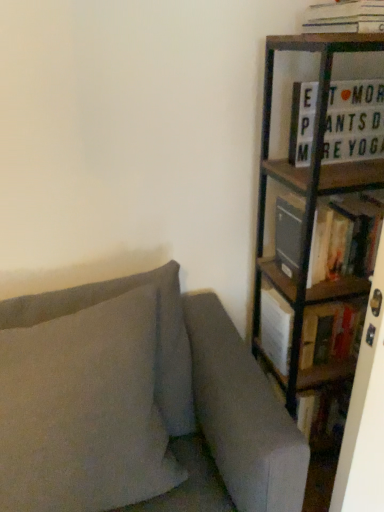
Question: Relative to white paper stack at upper right, which ranks as the third book in bottom-to-top order, is wooden bookcase at right in front or behind?

Choices:
 (A) front
 (B) behind

Answer: (A)

Question: Which is correct: wooden bookcase at right is inside white paper stack at upper right, which ranks as the third book in bottom-to-top order, or outside of it?

Choices:
 (A) outside
 (B) inside

Answer: (A)

Question: Which object is positioned farthest from the white paper stack at upper right, which ranks as the third book in bottom-to-top order?

Choices:
 (A) wooden bookshelf at right
 (B) white plastic sign at upper right, which is counted as the second book, starting from the top
 (C) hardcover book at right, which is the 1th book from bottom to top
 (D) suede-like gray pillow at left
 (E) wooden bookcase at right

Answer: (D)

Question: Which is nearer to the suede-like gray pillow at left?

Choices:
 (A) white plastic sign at upper right, which ranks as the 2th book in bottom-to-top order
 (B) white paper stack at upper right, which ranks as the first book in top-to-bottom order
 (C) wooden bookshelf at right
 (D) hardcover book at right, the 3th book positioned from the top
 (E) wooden bookcase at right

Answer: (E)